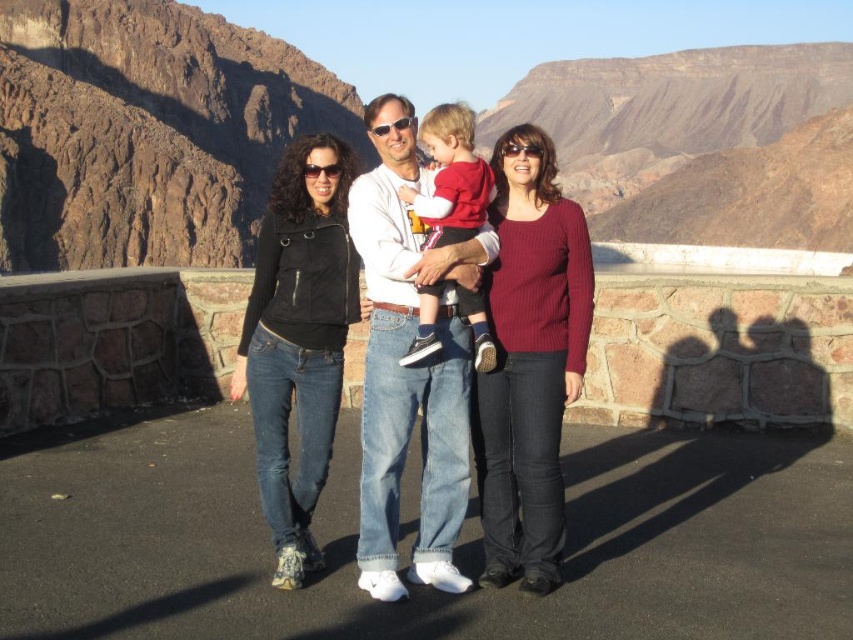
You are a photographer planning to take a group photo of the people in the scene. You want to ensure that the rugged rock formation at upper left and the white cotton shirt at center are both visible in the frame. Based on their positions, which object is higher in the image?

The rugged rock formation at upper left is above the white cotton shirt at center, so it is higher in the image.

You are a photographer planning to take a group photo of the four people in the scene. You want to ensure that the rugged rock formation at upper center and the ribbed sweater at center are both visible in the frame. Based on their positions, which object should be closer to the left edge of the photo?

The ribbed sweater at center is to the left of the rugged rock formation at upper center, so the ribbed sweater at center should be closer to the left edge of the photo.

You are a photographer trying to capture a group photo of the white cotton shirt at center and the black leather jacket at center. Since you want to ensure both subjects are in focus, you need to know which one is taller. Can you determine which is taller?

The white cotton shirt at center is taller than the black leather jacket at center, so you should adjust the camera settings to focus on the taller subject first.